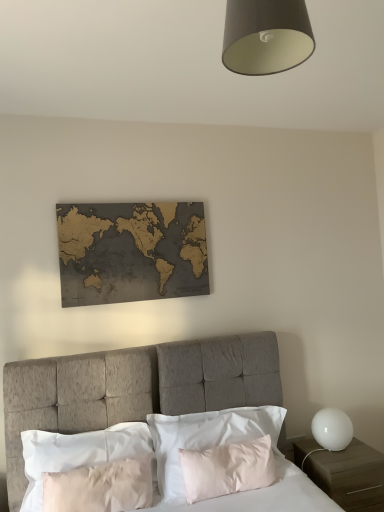
Describe the element at coordinates (77, 453) in the screenshot. I see `pale pink satin pillow at center, arranged as the first pillow when viewed from the left` at that location.

Identify the location of textured gray headboard at center. This screenshot has width=384, height=512. (133, 388).

Find the location of `gold-toned wood world map at upper center`. gold-toned wood world map at upper center is located at coordinates (131, 252).

Is white matte globe at right at the right side of white matte nightstand at lower right?

In fact, white matte globe at right is to the left of white matte nightstand at lower right.

From the picture: From the image's perspective, relative to white matte nightstand at lower right, is white matte globe at right above or below?

white matte globe at right is above white matte nightstand at lower right.

Does white matte globe at right contain white matte nightstand at lower right?

No, white matte nightstand at lower right is not inside white matte globe at right.

Looking at the image, does white matte globe at right seem bigger or smaller compared to white matte nightstand at lower right?

Clearly, white matte globe at right is smaller in size than white matte nightstand at lower right.

Would you say textured gray headboard at center is a long distance from silky white pillow at center, placed as the second pillow when sorted from left to right?

No.

Considering the points (6, 366) and (161, 429), which point is behind, point (6, 366) or point (161, 429)?

The point (161, 429) is farther from the camera.

What's the angular difference between textured gray headboard at center and silky white pillow at center, placed as the second pillow when sorted from left to right,'s facing directions?

The facing directions of textured gray headboard at center and silky white pillow at center, placed as the second pillow when sorted from left to right, are 1.09 degrees apart.

From the image's perspective, is pale pink satin pillow at center, placed as the second pillow when sorted from right to left, located beneath silky white pillow at center, the 1th pillow positioned from the right?

Yes, from the image's perspective, pale pink satin pillow at center, placed as the second pillow when sorted from right to left, is below silky white pillow at center, the 1th pillow positioned from the right.

Identify the location of pillow in front of the silky white pillow at center, placed as the second pillow when sorted from left to right. (77, 453).

Between pale pink satin pillow at center, placed as the second pillow when sorted from right to left, and silky white pillow at center, placed as the second pillow when sorted from left to right, which one has larger width?

Wider between the two is silky white pillow at center, placed as the second pillow when sorted from left to right.

How many degrees apart are the facing directions of pale pink satin pillow at center, arranged as the first pillow when viewed from the left, and silky white pillow at center, placed as the second pillow when sorted from left to right?

They differ by 0.000835 degrees in their facing directions.

In the scene shown: Between white matte globe at right and gold-toned wood world map at upper center, which one has smaller width?

gold-toned wood world map at upper center is thinner.

Do you think white matte globe at right is within gold-toned wood world map at upper center, or outside of it?

white matte globe at right is located beyond the bounds of gold-toned wood world map at upper center.

Image resolution: width=384 pixels, height=512 pixels. Identify the location of table lamp behind the gold-toned wood world map at upper center. (332, 429).

Between white matte globe at right and gold-toned wood world map at upper center, which one appears on the right side from the viewer's perspective?

From the viewer's perspective, white matte globe at right appears more on the right side.

From a real-world perspective, which object stands above the other?

silky white pillow at center, placed as the second pillow when sorted from left to right, from a real-world perspective.

Between silky white pillow at center, placed as the second pillow when sorted from left to right, and white matte globe at right, which one has less height?

With less height is white matte globe at right.

Consider the image. Which is more to the right, silky white pillow at center, placed as the second pillow when sorted from left to right, or white matte globe at right?

Positioned to the right is white matte globe at right.

Could white matte globe at right be considered to be inside silky white pillow at center, the 1th pillow positioned from the right?

No, white matte globe at right is located outside of silky white pillow at center, the 1th pillow positioned from the right.

Is textured gray headboard at center further to the viewer compared to white matte globe at right?

No, it is not.

Is textured gray headboard at center to the left or to the right of white matte globe at right in the image?

textured gray headboard at center is positioned on white matte globe at right's left side.

Does textured gray headboard at center turn towards white matte globe at right?

No, textured gray headboard at center is not oriented towards white matte globe at right.

Where is `bed located in front of the white matte globe at right`? bed located in front of the white matte globe at right is located at coordinates (133, 388).

Is silky white pillow at center, placed as the second pillow when sorted from left to right, taller or shorter than white matte nightstand at lower right?

Considering their sizes, silky white pillow at center, placed as the second pillow when sorted from left to right, has less height than white matte nightstand at lower right.

Is silky white pillow at center, placed as the second pillow when sorted from left to right, in contact with white matte nightstand at lower right?

They are not placed beside each other.

Identify the location of the 2nd pillow above the white matte nightstand at lower right (from the image's perspective). pos(206,438).

From the image's perspective, is silky white pillow at center, placed as the second pillow when sorted from left to right, located above or below white matte nightstand at lower right?

silky white pillow at center, placed as the second pillow when sorted from left to right, is above white matte nightstand at lower right.

The image size is (384, 512). What are the coordinates of `nightstand lying on the right of white matte globe at right` in the screenshot? It's located at (350, 476).

Image resolution: width=384 pixels, height=512 pixels. I want to click on bed lying below the silky white pillow at center, the 1th pillow positioned from the right (from the image's perspective), so click(133, 388).

Which object lies further to the anchor point silky white pillow at center, placed as the second pillow when sorted from left to right, white matte globe at right or gold-toned wood world map at upper center?

gold-toned wood world map at upper center.

Estimate the real-world distances between objects in this image. Which object is closer to silky white pillow at center, the 1th pillow positioned from the right, gold-toned wood world map at upper center or textured gray headboard at center?

textured gray headboard at center.

Looking at the image, which one is located closer to white matte globe at right, white matte nightstand at lower right or gold-toned wood world map at upper center?

Among the two, white matte nightstand at lower right is located nearer to white matte globe at right.

Based on their spatial positions, is textured gray headboard at center or gold-toned wood world map at upper center closer to pale pink satin pillow at center, arranged as the first pillow when viewed from the left?

textured gray headboard at center.

From the image, which object appears to be nearer to pale pink satin pillow at center, placed as the second pillow when sorted from right to left, gold-toned wood world map at upper center or silky white pillow at center, placed as the second pillow when sorted from left to right?

silky white pillow at center, placed as the second pillow when sorted from left to right, is closer to pale pink satin pillow at center, placed as the second pillow when sorted from right to left.

From the image, which object appears to be nearer to white matte nightstand at lower right, textured gray headboard at center or pale pink satin pillow at center, arranged as the first pillow when viewed from the left?

Based on the image, textured gray headboard at center appears to be nearer to white matte nightstand at lower right.

Considering their positions, is silky white pillow at center, placed as the second pillow when sorted from left to right, positioned further to textured gray headboard at center than gold-toned wood world map at upper center?

gold-toned wood world map at upper center is further to textured gray headboard at center.

Based on their spatial positions, is pale pink satin pillow at center, arranged as the first pillow when viewed from the left, or textured gray headboard at center closer to silky white pillow at center, the 1th pillow positioned from the right?

A: Among the two, textured gray headboard at center is located nearer to silky white pillow at center, the 1th pillow positioned from the right.

Identify the location of pillow located between pale pink satin pillow at center, arranged as the first pillow when viewed from the left, and white matte globe at right in the left-right direction. (206, 438).

What are the coordinates of `pillow situated between pale pink satin pillow at center, arranged as the first pillow when viewed from the left, and white matte nightstand at lower right from left to right` in the screenshot? It's located at point(206,438).

Find the location of a particular element. picture frame between pale pink satin pillow at center, arranged as the first pillow when viewed from the left, and white matte nightstand at lower right, in the horizontal direction is located at coordinates (131, 252).

Where is `pillow located between textured gray headboard at center and silky white pillow at center, placed as the second pillow when sorted from left to right, in the depth direction`? The width and height of the screenshot is (384, 512). pillow located between textured gray headboard at center and silky white pillow at center, placed as the second pillow when sorted from left to right, in the depth direction is located at coordinates (77, 453).